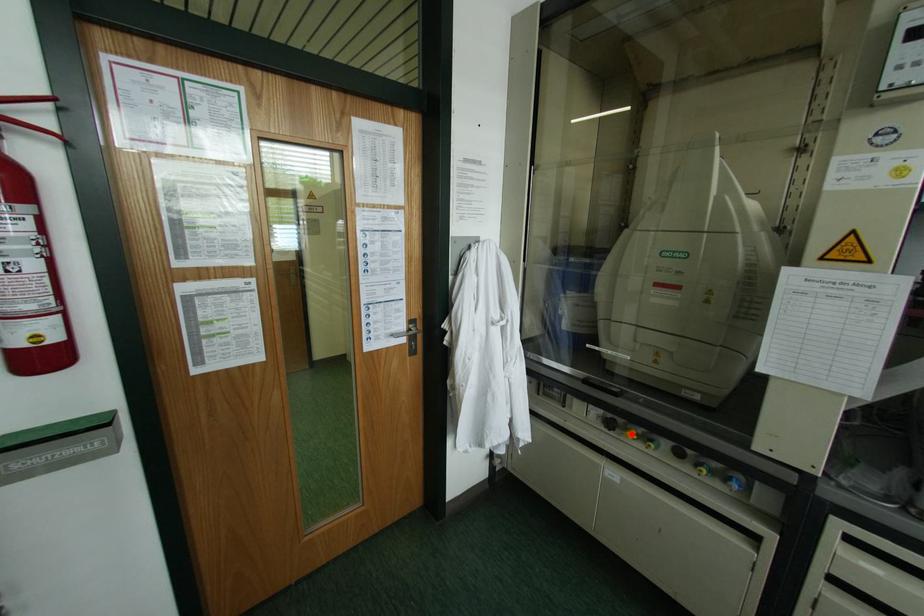
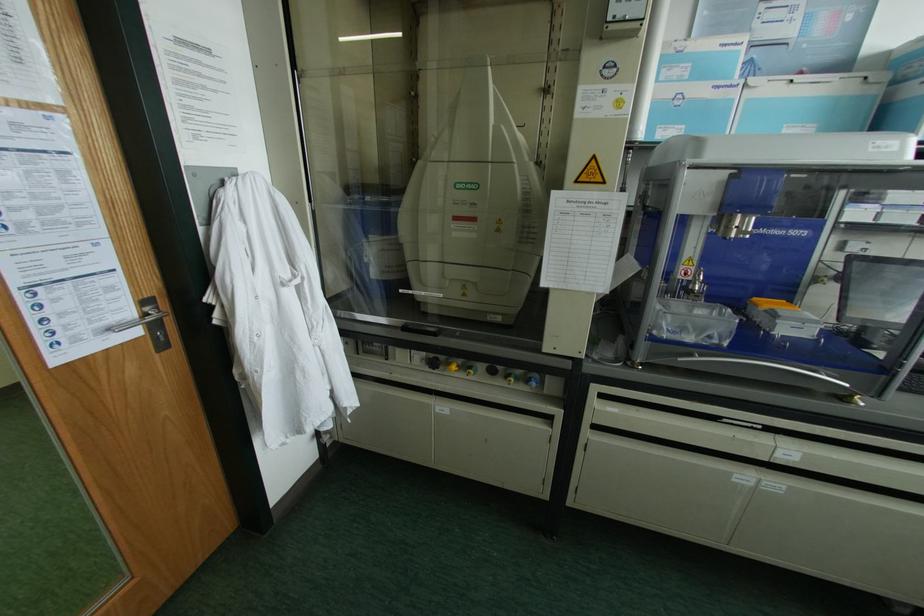
The point at the highlighted location is marked in the first image. Where is the corresponding point in the second image?

(454, 367)